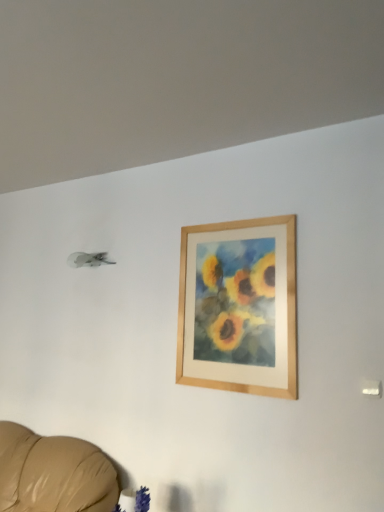
The image size is (384, 512). Describe the element at coordinates (133, 500) in the screenshot. I see `velvety blue plant at lower center` at that location.

At what (x,y) coordinates should I click in order to perform the action: click on velvety blue plant at lower center. Please return your answer as a coordinate pair (x, y). The image size is (384, 512). Looking at the image, I should click on (133, 500).

You are a GUI agent. You are given a task and a screenshot of the screen. Output one action in this format:
    pyautogui.click(x=<x>, y=<y>)
    Task: Click on the wooden frame at upper center
    The height and width of the screenshot is (512, 384).
    Given the screenshot: What is the action you would take?
    pyautogui.click(x=239, y=307)

What do you see at coordinates (239, 307) in the screenshot? I see `wooden frame at upper center` at bounding box center [239, 307].

This screenshot has width=384, height=512. In order to click on velvety blue plant at lower center in this screenshot , I will do `click(133, 500)`.

Does velvety blue plant at lower center appear on the left side of wooden frame at upper center?

Indeed, velvety blue plant at lower center is positioned on the left side of wooden frame at upper center.

Relative to wooden frame at upper center, is velvety blue plant at lower center in front or behind?

Clearly, velvety blue plant at lower center is in front of wooden frame at upper center.

Which is farther, (134, 504) or (262, 306)?

Positioned behind is point (262, 306).

From the image's perspective, is velvety blue plant at lower center below wooden frame at upper center?

Correct, velvety blue plant at lower center appears lower than wooden frame at upper center in the image.

Looking at this image, from a real-world perspective, is velvety blue plant at lower center physically below wooden frame at upper center?

Yes, from a real-world perspective, velvety blue plant at lower center is beneath wooden frame at upper center.

Looking at this image, considering the sizes of velvety blue plant at lower center and wooden frame at upper center in the image, is velvety blue plant at lower center wider or thinner than wooden frame at upper center?

velvety blue plant at lower center is wider than wooden frame at upper center.

Between velvety blue plant at lower center and wooden frame at upper center, which one has less height?

velvety blue plant at lower center is shorter.

Does velvety blue plant at lower center have a larger size compared to wooden frame at upper center?

Actually, velvety blue plant at lower center might be smaller than wooden frame at upper center.

Is velvety blue plant at lower center inside or outside of wooden frame at upper center?

velvety blue plant at lower center is not inside wooden frame at upper center, it's outside.

Is velvety blue plant at lower center directly adjacent to wooden frame at upper center?

They are not placed beside each other.

Is wooden frame at upper center at the back of velvety blue plant at lower center?

No, wooden frame at upper center is not at the back of velvety blue plant at lower center.

How many degrees apart are the facing directions of velvety blue plant at lower center and wooden frame at upper center?

1.68 degrees.

How distant is velvety blue plant at lower center from wooden frame at upper center?

velvety blue plant at lower center is 38.63 inches away from wooden frame at upper center.

In the image, there is a wooden frame at upper center. Identify the location of plant below it (from the image's perspective). The image size is (384, 512). (133, 500).

Is wooden frame at upper center to the right of velvety blue plant at lower center from the viewer's perspective?

Correct, you'll find wooden frame at upper center to the right of velvety blue plant at lower center.

Which object is closer to the camera, wooden frame at upper center or velvety blue plant at lower center?

velvety blue plant at lower center is in front.

Does point (193, 302) come in front of point (120, 497)?

No, (193, 302) is behind (120, 497).

From the image's perspective, is wooden frame at upper center located above velvety blue plant at lower center?

Yes.

From a real-world perspective, which object rests below the other?

velvety blue plant at lower center.

Which of these two, wooden frame at upper center or velvety blue plant at lower center, is wider?

Wider between the two is velvety blue plant at lower center.

Between wooden frame at upper center and velvety blue plant at lower center, which one has more height?

wooden frame at upper center.

Considering the relative sizes of wooden frame at upper center and velvety blue plant at lower center in the image provided, is wooden frame at upper center bigger than velvety blue plant at lower center?

Indeed, wooden frame at upper center has a larger size compared to velvety blue plant at lower center.

Is wooden frame at upper center surrounding velvety blue plant at lower center?

Definitely not — velvety blue plant at lower center is not inside wooden frame at upper center.

Are wooden frame at upper center and velvety blue plant at lower center located far from each other?

No.

Consider the image. Is wooden frame at upper center looking in the opposite direction of velvety blue plant at lower center?

No, wooden frame at upper center is not facing away from velvety blue plant at lower center.

How many degrees apart are the facing directions of wooden frame at upper center and velvety blue plant at lower center?

There is a 1.68-degree angle between the facing directions of wooden frame at upper center and velvety blue plant at lower center.

Measure the distance between wooden frame at upper center and velvety blue plant at lower center.

wooden frame at upper center and velvety blue plant at lower center are 98.11 centimeters apart from each other.

In order to click on picture frame located on the right of velvety blue plant at lower center in this screenshot , I will do `click(239, 307)`.

In the image, there is a velvety blue plant at lower center. Where is `picture frame above it (from the image's perspective)`? The image size is (384, 512). picture frame above it (from the image's perspective) is located at coordinates (239, 307).

The height and width of the screenshot is (512, 384). I want to click on picture frame behind the velvety blue plant at lower center, so click(239, 307).